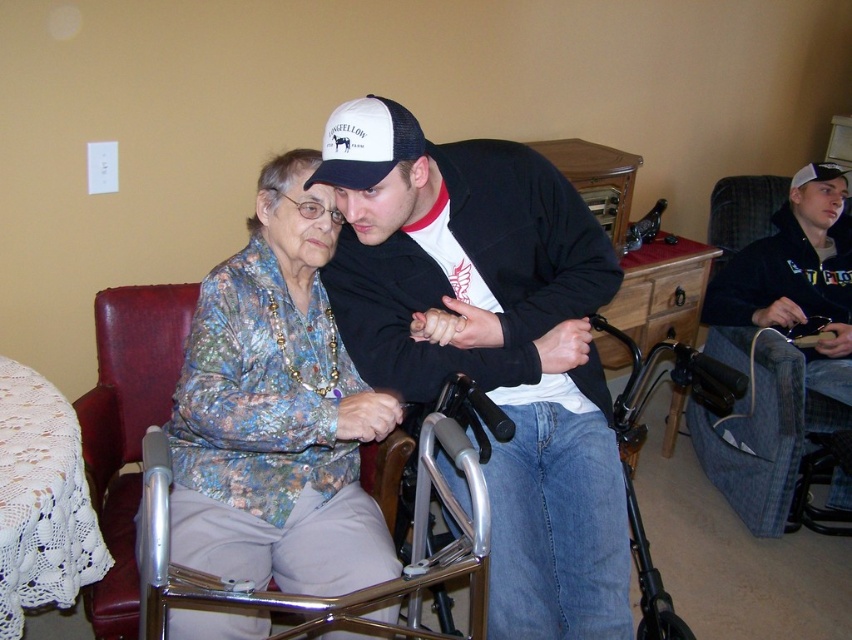
You are a fashion designer observing the scene and want to place a new accessory between the matte black jacket at center and the silver metallic walker at center. Which object should the accessory be placed closer to if it needs to be positioned at a lower height?

The accessory should be placed closer to the silver metallic walker at center because the matte black jacket at center is taller than the silver metallic walker at center, so the walker is shorter and thus lower in height.

From the picture: You are a delivery person who needs to place a small package between the silver metallic walker at center and the white mesh baseball cap at upper center. Can you fit the package in the space between them?

The silver metallic walker at center and white mesh baseball cap at upper center are 29.11 inches apart from each other, so yes, the package can fit between them as the distance is sufficient.

You are a fashion designer observing the scene. You notice the floral fabric blouse at center and the black hoodie at right. Which clothing item is located lower in the image?

The floral fabric blouse at center is positioned under the black hoodie at right, so it is located lower in the image.